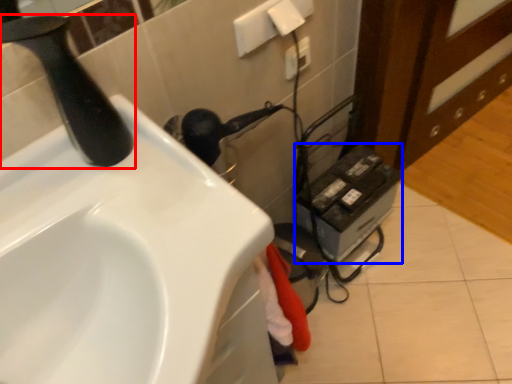
Question: Which object is closer to the camera taking this photo, tap (highlighted by a red box) or appliance (highlighted by a blue box)?

Choices:
 (A) tap
 (B) appliance

Answer: (A)